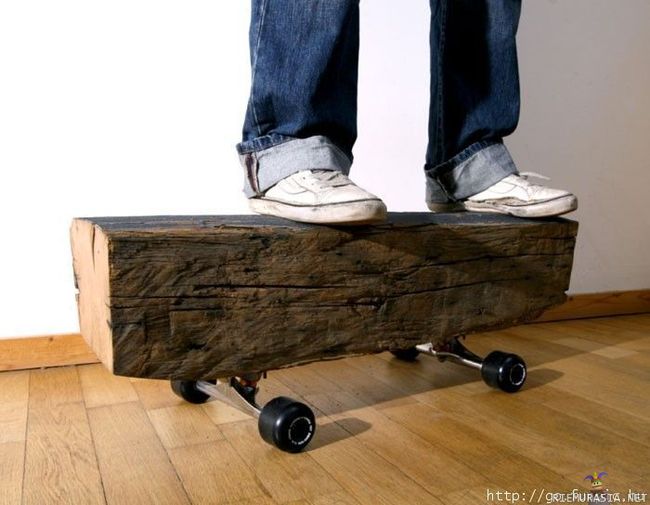
Image resolution: width=650 pixels, height=505 pixels. In order to click on baseboard in this screenshot , I will do `click(45, 352)`.